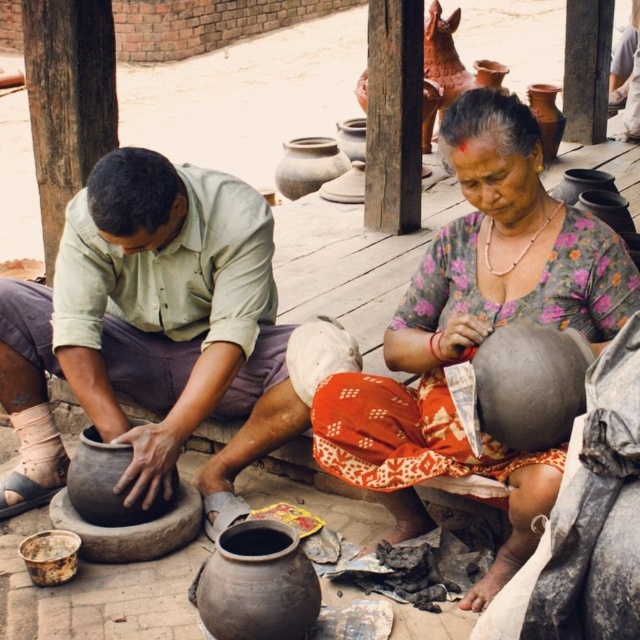
You are a pottery student observing the scene. You see the matte clay pot at left and the matte gray pot at center. Which pot is located to the right of the other?

The matte gray pot at center is located to the right of the matte clay pot at left.

You are a pottery student observing the scene. You need to reach both the matte clay pot at left and the matte gray pot at center. Which pot should you approach first to get closer to the one that is nearer to you?

You should approach the matte clay pot at left first because it is closer to you than the matte gray pot at center, so you can reach it more easily.

You are standing in front of the pottery scene and want to place a small decoration between the two points, point (483, 90) and point (52, 563). Which point should you place it closer to so it appears larger in the image?

You should place the decoration closer to point (483, 90) because it is closer to the viewer than point (52, 563), making the decoration appear larger when placed near it.